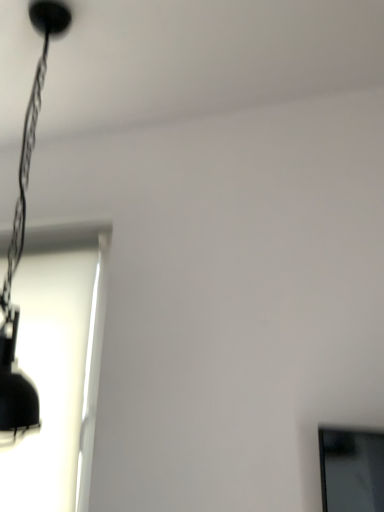
Measure the distance between white matte window at left and camera.

white matte window at left and camera are 3.89 feet apart.

Where is `white matte window at left`? Image resolution: width=384 pixels, height=512 pixels. white matte window at left is located at coordinates (58, 366).

What do you see at coordinates (58, 366) in the screenshot?
I see `white matte window at left` at bounding box center [58, 366].

What do you see at coordinates (24, 237) in the screenshot? Image resolution: width=384 pixels, height=512 pixels. I see `matte black lamp at upper left` at bounding box center [24, 237].

In order to face matte black lamp at upper left, should I rotate leftwards or rightwards?

Rotate your view left by about 22.153°.

The width and height of the screenshot is (384, 512). In order to click on matte black lamp at upper left in this screenshot , I will do `click(24, 237)`.

Locate an element on the screen. white matte window at left is located at coordinates (58, 366).

Does white matte window at left appear on the right side of matte black lamp at upper left?

No, white matte window at left is not to the right of matte black lamp at upper left.

Which object is further away from the camera, white matte window at left or matte black lamp at upper left?

Positioned behind is white matte window at left.

Is point (40, 285) positioned in front of point (2, 422)?

No.

From the image's perspective, is white matte window at left on matte black lamp at upper left?

No, from the image's perspective, white matte window at left is not above matte black lamp at upper left.

From a real-world perspective, is white matte window at left positioned over matte black lamp at upper left based on gravity?

No, from a real-world perspective, white matte window at left is not on top of matte black lamp at upper left.

Can you confirm if white matte window at left is thinner than matte black lamp at upper left?

Indeed, white matte window at left has a lesser width compared to matte black lamp at upper left.

Is white matte window at left taller or shorter than matte black lamp at upper left?

Considering their sizes, white matte window at left has less height than matte black lamp at upper left.

Considering the sizes of objects white matte window at left and matte black lamp at upper left in the image provided, who is bigger, white matte window at left or matte black lamp at upper left?

matte black lamp at upper left is bigger.

Choose the correct answer: Is white matte window at left inside matte black lamp at upper left or outside it?

The correct answer is: outside.

Would you consider white matte window at left to be distant from matte black lamp at upper left?

No.

Is white matte window at left turned away from matte black lamp at upper left?

white matte window at left does not have its back to matte black lamp at upper left.

How different are the orientations of white matte window at left and matte black lamp at upper left in degrees?

There is a 0.714-degree angle between the facing directions of white matte window at left and matte black lamp at upper left.

Locate an element on the screen. window that appears below the matte black lamp at upper left (from a real-world perspective) is located at coordinates (58, 366).

Does matte black lamp at upper left appear on the right side of white matte window at left?

Yes.

Does matte black lamp at upper left lie in front of white matte window at left?

Yes, matte black lamp at upper left is in front of white matte window at left.

Between point (2, 336) and point (39, 241), which one is positioned in front?

The point (2, 336) is closer to the camera.

From the image's perspective, which is above, matte black lamp at upper left or white matte window at left?

matte black lamp at upper left.

From a real-world perspective, between matte black lamp at upper left and white matte window at left, who is vertically lower?

white matte window at left.

In the scene shown: Looking at their sizes, would you say matte black lamp at upper left is wider or thinner than white matte window at left?

Clearly, matte black lamp at upper left has more width compared to white matte window at left.

Which of these two, matte black lamp at upper left or white matte window at left, stands taller?

matte black lamp at upper left.

Considering the relative sizes of matte black lamp at upper left and white matte window at left in the image provided, is matte black lamp at upper left smaller than white matte window at left?

Actually, matte black lamp at upper left might be larger than white matte window at left.

Is matte black lamp at upper left not inside white matte window at left?

Yes, matte black lamp at upper left is not within white matte window at left.

Is matte black lamp at upper left directly adjacent to white matte window at left?

No.

Does matte black lamp at upper left turn towards white matte window at left?

No, matte black lamp at upper left is not turned towards white matte window at left.

Measure the distance from matte black lamp at upper left to white matte window at left.

matte black lamp at upper left is 16.13 inches from white matte window at left.

At what (x,y) coordinates should I click in order to perform the action: click on lamp above the white matte window at left (from the image's perspective). Please return your answer as a coordinate pair (x, y). This screenshot has width=384, height=512. Looking at the image, I should click on (24, 237).

Find the location of a particular element. The image size is (384, 512). lamp above the white matte window at left (from a real-world perspective) is located at coordinates (24, 237).

This screenshot has width=384, height=512. Find the location of `window beneath the matte black lamp at upper left (from a real-world perspective)`. window beneath the matte black lamp at upper left (from a real-world perspective) is located at coordinates (58, 366).